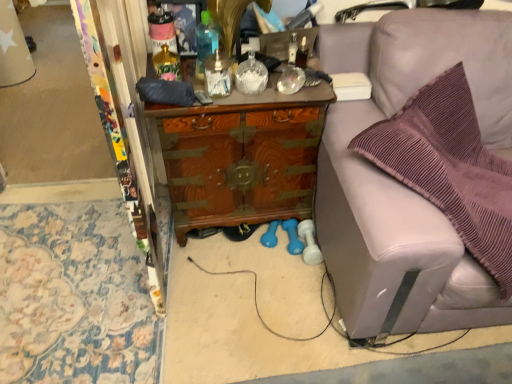
Question: Looking at the image, does clear glass jar at center, which appears as the 1th bottle when viewed from the right, seem bigger or smaller compared to translucent glass vase at center, the second bottle from the left?

Choices:
 (A) big
 (B) small

Answer: (A)

Question: From a real-world perspective, is clear glass jar at center, which appears as the 1th bottle when viewed from the right, above or below translucent glass vase at center, placed as the 4th bottle when sorted from right to left?

Choices:
 (A) below
 (B) above

Answer: (A)

Question: Which is farther from the translucent blue bottle at center, placed as the 3th bottle when sorted from right to left?

Choices:
 (A) purple fabric chair at right
 (B) translucent glass vase at center, placed as the 4th bottle when sorted from right to left
 (C) black matte remote control at center
 (D) clear glass jar at center, which appears as the 1th bottle when viewed from the right
 (E) clear glass soap dispenser at center, the 2th bottle from the right

Answer: (A)

Question: Based on their relative distances, which object is nearer to the clear glass jar at center, which is the 5th bottle in left-to-right order?

Choices:
 (A) translucent glass vase at center, the second bottle from the left
 (B) translucent blue bottle at center, the third bottle when ordered from left to right
 (C) clear glass soap dispenser at center, the 2th bottle from the right
 (D) wooden chest at center
 (E) black matte remote control at center

Answer: (C)